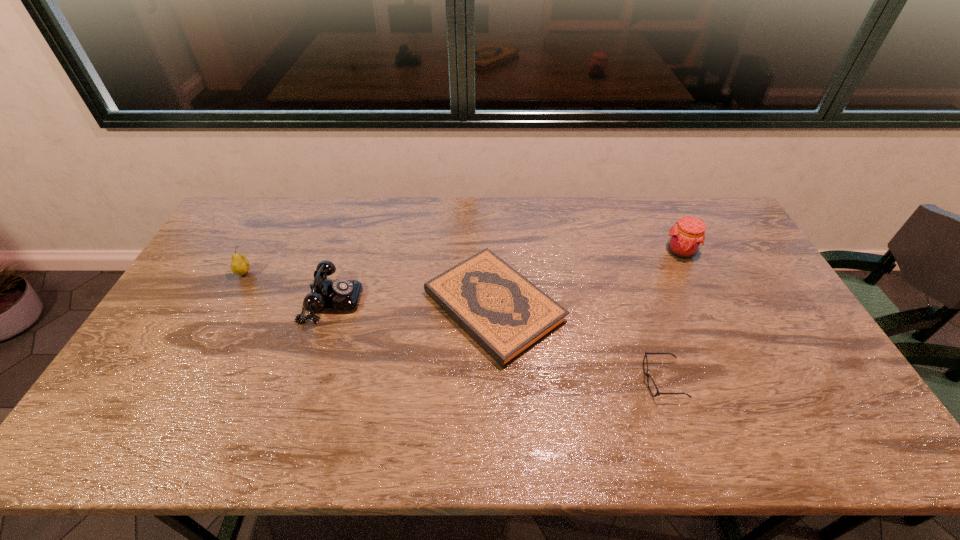
Locate an element on the screen. Image resolution: width=960 pixels, height=540 pixels. jam is located at coordinates (688, 234).

Locate an element on the screen. The width and height of the screenshot is (960, 540). the rightmost object is located at coordinates (688, 234).

The width and height of the screenshot is (960, 540). Identify the location of telephone. (340, 296).

You are a GUI agent. You are given a task and a screenshot of the screen. Output one action in this format:
    pyautogui.click(x=<x>, y=<y>)
    Task: Click on the leftmost object
    Image resolution: width=960 pixels, height=540 pixels.
    Given the screenshot: What is the action you would take?
    pyautogui.click(x=239, y=265)

Locate an element on the screen. The image size is (960, 540). the third object from right to left is located at coordinates (503, 312).

Where is `spectacles`? This screenshot has height=540, width=960. spectacles is located at coordinates (658, 393).

I want to click on vacant position located 0.350m on the front of the rightmost object, so click(x=730, y=352).

Where is `vacant region located 0.100m on the dial of the fourth object from right to left`? This screenshot has height=540, width=960. vacant region located 0.100m on the dial of the fourth object from right to left is located at coordinates (393, 301).

Identify the location of free spot located 0.290m on the back of the pear. This screenshot has width=960, height=540. (277, 212).

The width and height of the screenshot is (960, 540). I want to click on blank space located on the left of the third object from left to right, so click(312, 307).